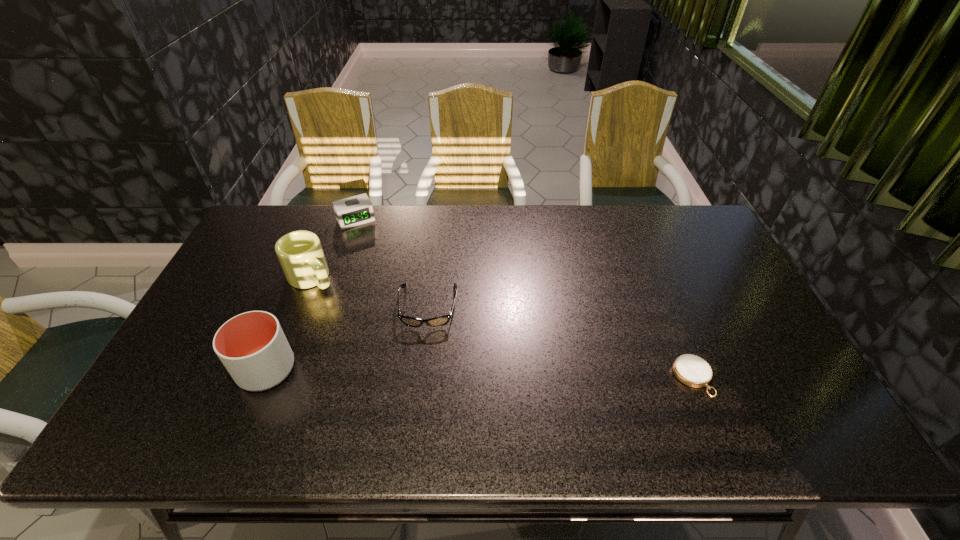
The image size is (960, 540). I want to click on cup, so click(252, 346).

Locate an element on the screen. the rightmost object is located at coordinates (691, 370).

Locate an element on the screen. The width and height of the screenshot is (960, 540). compass is located at coordinates (691, 370).

Find the location of a particular element. This screenshot has height=540, width=960. the second object from right to left is located at coordinates (439, 321).

This screenshot has width=960, height=540. Identify the location of spectacles. (439, 321).

Image resolution: width=960 pixels, height=540 pixels. Find the location of `the third shortest object`. the third shortest object is located at coordinates (356, 210).

I want to click on alarm clock, so click(356, 210).

At what (x,y) coordinates should I click in order to perform the action: click on mug. Please return your answer as a coordinate pair (x, y). The width and height of the screenshot is (960, 540). Looking at the image, I should click on (300, 253).

Where is `vacant area situated 0.150m on the left of the cup`? vacant area situated 0.150m on the left of the cup is located at coordinates (179, 370).

At what (x,y) coordinates should I click in order to perform the action: click on vacant space located on the back of the compass. Please return your answer as a coordinate pair (x, y). The height and width of the screenshot is (540, 960). Looking at the image, I should click on (669, 320).